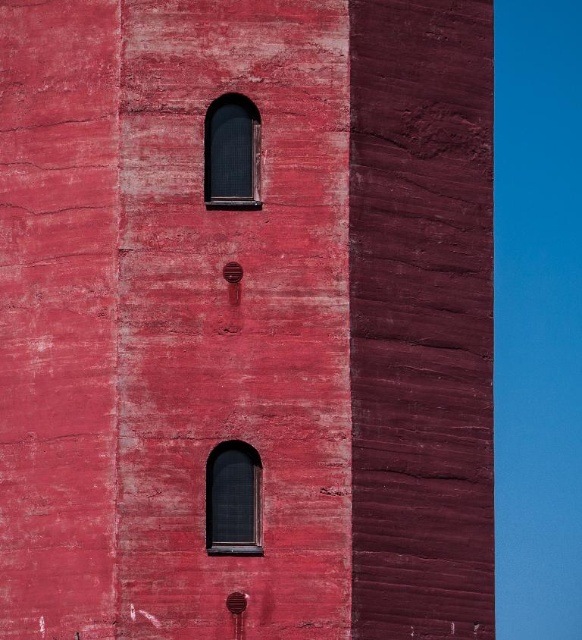
Is matte black window at upper center further to the viewer compared to matte black window at lower center?

Yes, matte black window at upper center is further from the viewer.

Based on the photo, between matte black window at upper center and matte black window at lower center, which one is positioned higher?

Positioned higher is matte black window at upper center.

Is point (228, 157) positioned after point (212, 449)?

Yes, point (228, 157) is behind point (212, 449).

Locate an element on the screen. The height and width of the screenshot is (640, 582). matte black window at upper center is located at coordinates (232, 154).